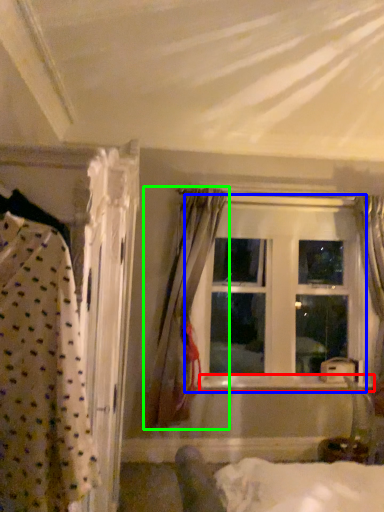
Question: Which object is positioned farthest from window sill (highlighted by a red box)? Select from window (highlighted by a blue box) and curtain (highlighted by a green box).

Choices:
 (A) window
 (B) curtain

Answer: (B)